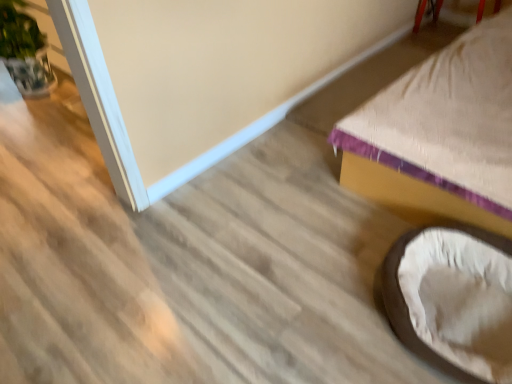
Describe the element at coordinates (441, 132) in the screenshot. I see `beige fabric bed at lower right` at that location.

Locate an element on the screen. This screenshot has height=384, width=512. soft beige fabric bean bag chair at lower right is located at coordinates (453, 300).

From a real-world perspective, which is physically above, soft beige fabric bean bag chair at lower right or green leafy plant at left?

From a 3D spatial view, green leafy plant at left is above.

Could green leafy plant at left be considered to be inside soft beige fabric bean bag chair at lower right?

No, green leafy plant at left is not inside soft beige fabric bean bag chair at lower right.

Which is in front, point (454, 277) or point (33, 37)?

The point (454, 277) is closer.

Considering the relative sizes of soft beige fabric bean bag chair at lower right and green leafy plant at left in the image provided, is soft beige fabric bean bag chair at lower right taller than green leafy plant at left?

No.

Which of these two, beige fabric bed at lower right or green leafy plant at left, stands taller?

beige fabric bed at lower right.

Which object is positioned more to the right, beige fabric bed at lower right or green leafy plant at left?

Positioned to the right is beige fabric bed at lower right.

Considering the relative sizes of beige fabric bed at lower right and green leafy plant at left in the image provided, is beige fabric bed at lower right wider than green leafy plant at left?

Yes.

From a real-world perspective, who is located higher, beige fabric bed at lower right or green leafy plant at left?

beige fabric bed at lower right.

Is green leafy plant at left not near beige fabric bed at lower right?

green leafy plant at left is far away from beige fabric bed at lower right.

Looking at this image, considering the sizes of objects green leafy plant at left and beige fabric bed at lower right in the image provided, who is bigger, green leafy plant at left or beige fabric bed at lower right?

Bigger between the two is beige fabric bed at lower right.

Does green leafy plant at left have a greater width compared to soft beige fabric bean bag chair at lower right?

No.

From a real-world perspective, is green leafy plant at left above or below soft beige fabric bean bag chair at lower right?

In terms of real-world spatial position, green leafy plant at left is above soft beige fabric bean bag chair at lower right.

In the scene shown: Who is taller, green leafy plant at left or soft beige fabric bean bag chair at lower right?

Standing taller between the two is green leafy plant at left.

The width and height of the screenshot is (512, 384). I want to click on furniture in front of the soft beige fabric bean bag chair at lower right, so click(441, 132).

Does soft beige fabric bean bag chair at lower right come behind beige fabric bed at lower right?

Yes.

Measure the distance from soft beige fabric bean bag chair at lower right to beige fabric bed at lower right.

soft beige fabric bean bag chair at lower right and beige fabric bed at lower right are 18.02 inches apart from each other.

Which is more to the left, beige fabric bed at lower right or soft beige fabric bean bag chair at lower right?

soft beige fabric bean bag chair at lower right is more to the left.

Is beige fabric bed at lower right smaller than soft beige fabric bean bag chair at lower right?

Incorrect, beige fabric bed at lower right is not smaller in size than soft beige fabric bean bag chair at lower right.

Is beige fabric bed at lower right in contact with soft beige fabric bean bag chair at lower right?

No, beige fabric bed at lower right is not beside soft beige fabric bean bag chair at lower right.

From the image's perspective, is beige fabric bed at lower right beneath soft beige fabric bean bag chair at lower right?

No, from the image's perspective, beige fabric bed at lower right is not below soft beige fabric bean bag chair at lower right.

This screenshot has height=384, width=512. What are the coordinates of `bean bag chair below the green leafy plant at left (from a real-world perspective)` in the screenshot? It's located at (453, 300).

Identify the location of plant above the beige fabric bed at lower right (from the image's perspective). This screenshot has width=512, height=384. 24,50.

When comparing their distances from green leafy plant at left, does beige fabric bed at lower right or soft beige fabric bean bag chair at lower right seem further?

soft beige fabric bean bag chair at lower right.

Based on their spatial positions, is beige fabric bed at lower right or green leafy plant at left further from soft beige fabric bean bag chair at lower right?

Based on the image, green leafy plant at left appears to be further to soft beige fabric bean bag chair at lower right.

When comparing their distances from beige fabric bed at lower right, does soft beige fabric bean bag chair at lower right or green leafy plant at left seem closer?

soft beige fabric bean bag chair at lower right is positioned closer to the anchor beige fabric bed at lower right.

Looking at this image, estimate the real-world distances between objects in this image. Which object is further from soft beige fabric bean bag chair at lower right, green leafy plant at left or beige fabric bed at lower right?

Based on the image, green leafy plant at left appears to be further to soft beige fabric bean bag chair at lower right.

Which object lies nearer to the anchor point beige fabric bed at lower right, green leafy plant at left or soft beige fabric bean bag chair at lower right?

Based on the image, soft beige fabric bean bag chair at lower right appears to be nearer to beige fabric bed at lower right.

In the scene shown: Estimate the real-world distances between objects in this image. Which object is closer to green leafy plant at left, soft beige fabric bean bag chair at lower right or beige fabric bed at lower right?

Among the two, beige fabric bed at lower right is located nearer to green leafy plant at left.

You are a GUI agent. You are given a task and a screenshot of the screen. Output one action in this format:
    pyautogui.click(x=<x>, y=<y>)
    Task: Click on the bean bag chair between green leafy plant at left and beige fabric bed at lower right from left to right
    
    Given the screenshot: What is the action you would take?
    (x=453, y=300)